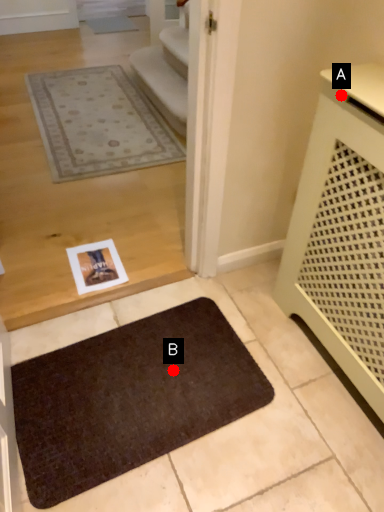
Question: Two points are circled on the image, labeled by A and B beside each circle. Which of the following is the farthest from the observer?

Choices:
 (A) A is further
 (B) B is further

Answer: (B)